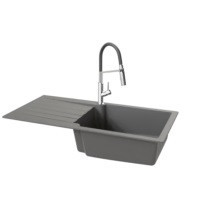
Find the location of `knob`. knob is located at coordinates (109, 90).